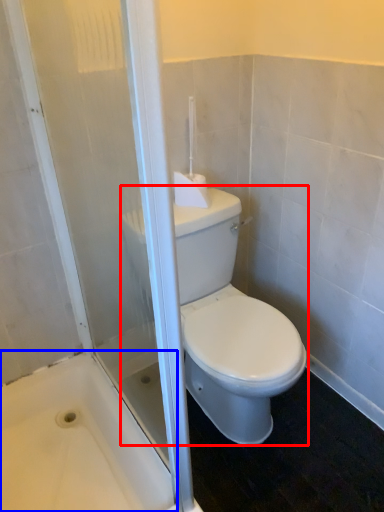
Question: Which of the following is the farthest to the observer, porcelain (highlighted by a red box) or bath (highlighted by a blue box)?

Choices:
 (A) porcelain
 (B) bath

Answer: (A)